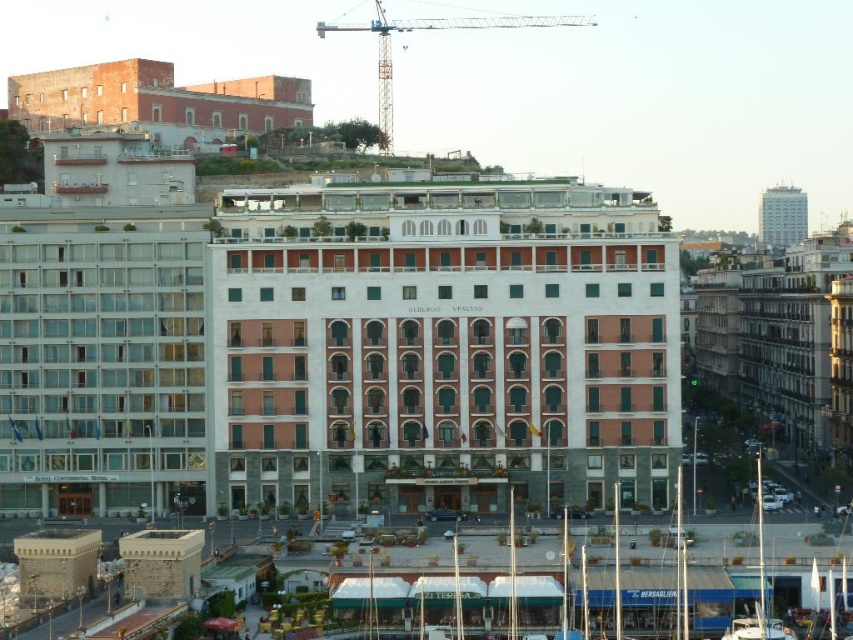
Question: Is red brick building at center closer to the viewer compared to matte glass windows at left?

Choices:
 (A) no
 (B) yes

Answer: (B)

Question: Which point is closer to the camera?

Choices:
 (A) brick wall building at upper left
 (B) white plastic boat at lower right

Answer: (B)

Question: Is red brick building at center smaller than beige stone building at right?

Choices:
 (A) yes
 (B) no

Answer: (B)

Question: Which point is farther to the camera?

Choices:
 (A) white plastic boat at lower right
 (B) brick wall building at upper left
 (C) matte glass windows at left
 (D) metallic construction crane at upper center

Answer: (D)

Question: Which of the following is the closest to the observer?

Choices:
 (A) beige stone building at right
 (B) brick wall building at upper left
 (C) metallic construction crane at upper center

Answer: (A)

Question: Does red brick building at center have a smaller size compared to metallic construction crane at upper center?

Choices:
 (A) no
 (B) yes

Answer: (B)